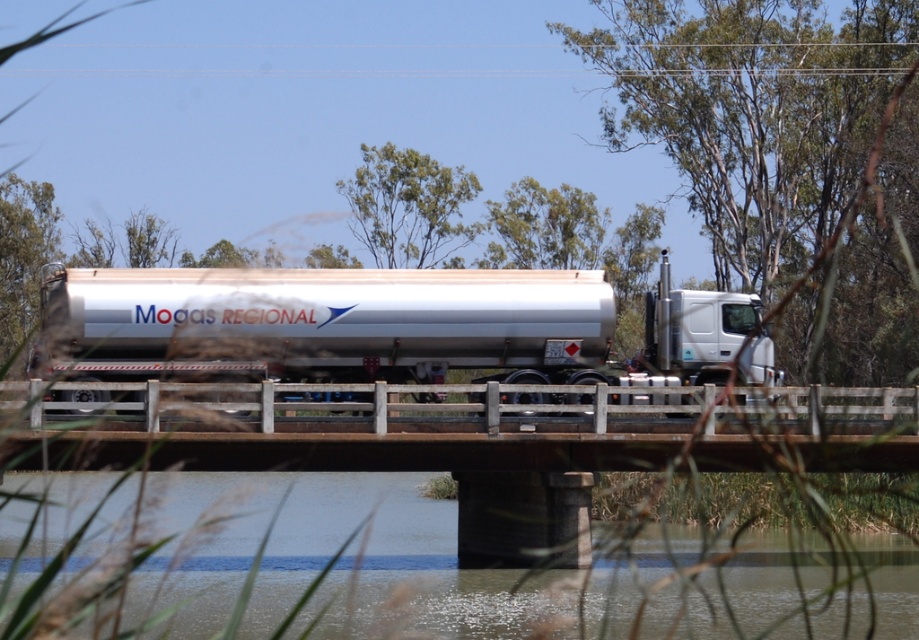
Question: Which point is farther to the camera?

Choices:
 (A) brushed metal trailer truck at center
 (B) clear water at bridge center

Answer: (A)

Question: Is brushed metal trailer truck at center closer to the viewer compared to white glossy truck at center?

Choices:
 (A) no
 (B) yes

Answer: (B)

Question: Does clear water at bridge center appear on the left side of white glossy truck at center?

Choices:
 (A) yes
 (B) no

Answer: (A)

Question: Is clear water at bridge center positioned behind white glossy truck at center?

Choices:
 (A) yes
 (B) no

Answer: (B)

Question: Which of these objects is positioned closest to the clear water at bridge center?

Choices:
 (A) brushed metal trailer truck at center
 (B) white glossy truck at center
 (C) concrete bridge at center

Answer: (C)

Question: Which point is closer to the camera?

Choices:
 (A) (206, 628)
 (B) (585, 422)

Answer: (A)